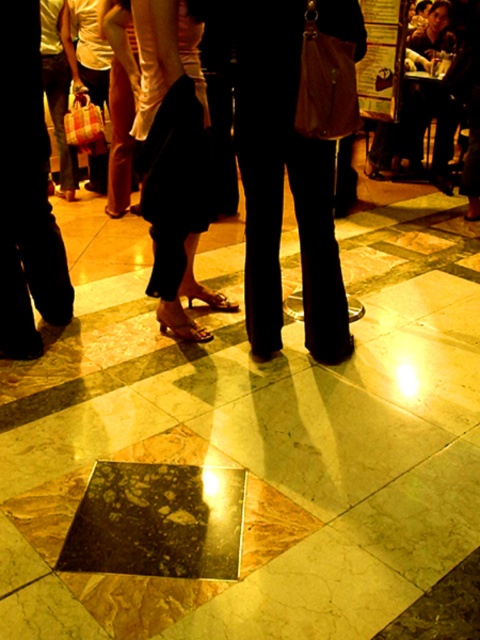
You are a photographer trying to capture a candid shot of both the dark brown leather pants at center and the black leather pants at left. Since you can only focus on one subject at a time, which person should you focus on to ensure the other is still in the background?

You should focus on the dark brown leather pants at center because it is in front of the black leather pants at left, so the black leather pants at left will naturally appear in the background.